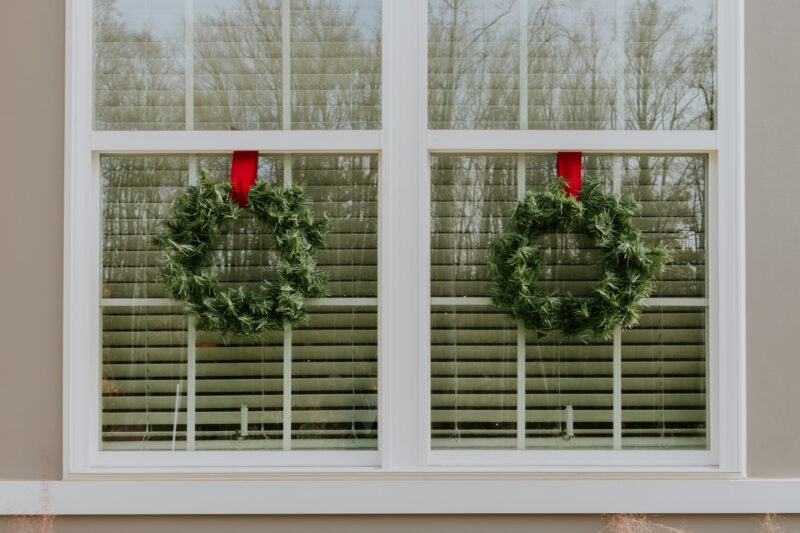
Where is `lower left window pane`? The width and height of the screenshot is (800, 533). lower left window pane is located at coordinates click(134, 383).